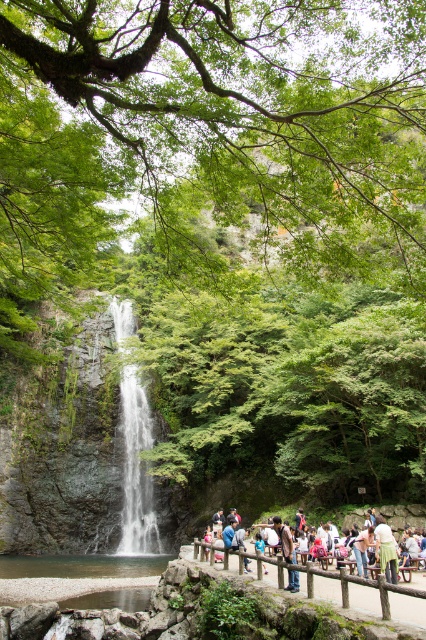
You are standing at the viewing platform and want to take a photo of the white glossy waterfall at center without including the wooden fence at center in the frame. Which direction should you move to achieve this?

Move to the right side of the wooden fence at center to capture the white glossy waterfall at center without the fence obstructing the view, as the waterfall is on the left side of the fence.

You are standing on a viewing platform near the waterfall. There is a wooden fence at center and a green fabric dress at center. Which object is closer to your feet?

The wooden fence at center is closer to your feet because it is positioned below the green fabric dress at center.